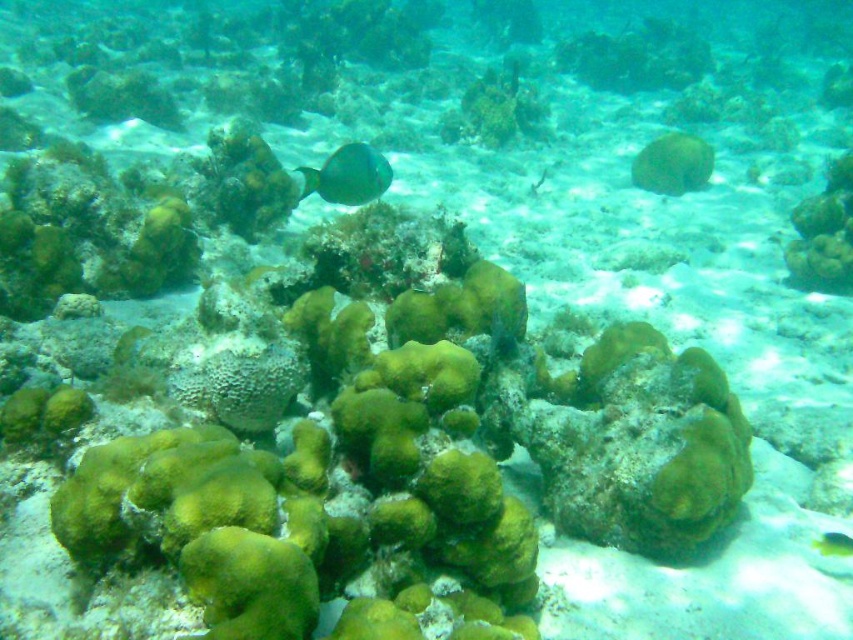
You are a marine biologist observing an underwater scene at a coral reef. You notice the green matte coral at upper center and the green matte fish at center. Which object is taller in this image?

The green matte coral at upper center is taller than the green matte fish at center according to the description.

You are a marine biologist studying the coral reef. You notice a fish at point (650, 152) and some corals in the foreground. How far apart are the fish and the corals?

The fish at point (650, 152) and the corals in the foreground are 4.88 meters apart.